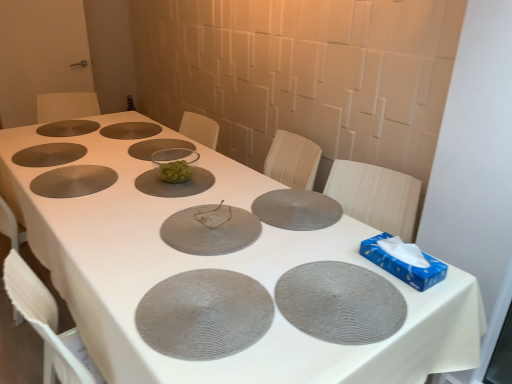
This screenshot has width=512, height=384. I want to click on vacant area that lies between matte gray plate at upper left, which is the 7th glass plate in front-to-back order, and matte gray placemat at left, which appears as the fifth glass plate when viewed from the front, so click(56, 163).